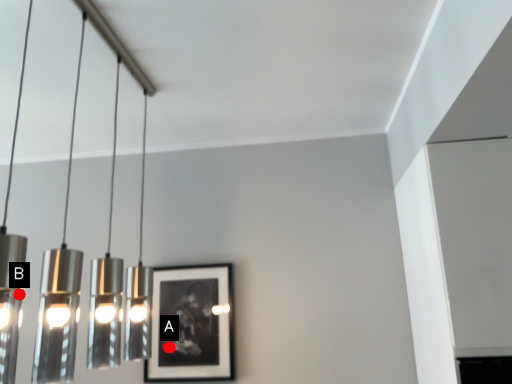
Question: Two points are circled on the image, labeled by A and B beside each circle. Which point is closer to the camera?

Choices:
 (A) A is closer
 (B) B is closer

Answer: (A)